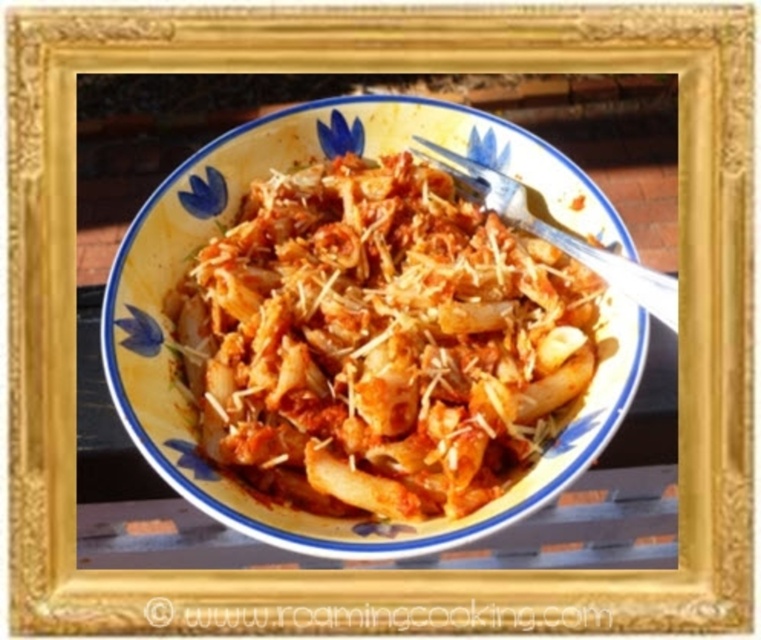
Question: Is reddish-brown glossy pasta at center above silver metallic fork at upper center?

Choices:
 (A) yes
 (B) no

Answer: (B)

Question: Which point is farther from the camera taking this photo?

Choices:
 (A) (518, 196)
 (B) (336, 512)

Answer: (A)

Question: Which object appears farthest from the camera in this image?

Choices:
 (A) reddish-brown glossy pasta at center
 (B) silver metallic fork at upper center

Answer: (B)

Question: Among these objects, which one is farthest from the camera?

Choices:
 (A) silver metallic fork at upper center
 (B) reddish-brown glossy pasta at center

Answer: (A)

Question: Is reddish-brown glossy pasta at center above silver metallic fork at upper center?

Choices:
 (A) yes
 (B) no

Answer: (B)

Question: Does reddish-brown glossy pasta at center appear on the left side of silver metallic fork at upper center?

Choices:
 (A) no
 (B) yes

Answer: (B)